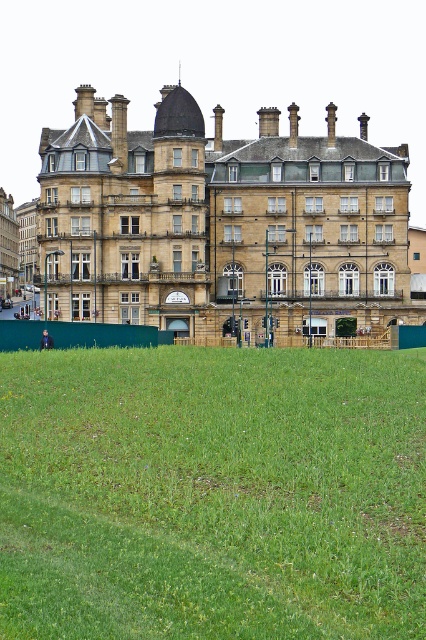
Question: Which point is closer to the camera?

Choices:
 (A) (195, 352)
 (B) (166, 134)

Answer: (A)

Question: Does green grass at lower center have a lesser width compared to brown stone building at center?

Choices:
 (A) no
 (B) yes

Answer: (B)

Question: Is green grass at lower center closer to the viewer compared to brown stone building at center?

Choices:
 (A) no
 (B) yes

Answer: (B)

Question: Which object is closer to the camera taking this photo?

Choices:
 (A) green grass at lower center
 (B) brown stone building at center

Answer: (A)

Question: Is green grass at lower center positioned at the back of brown stone building at center?

Choices:
 (A) no
 (B) yes

Answer: (A)